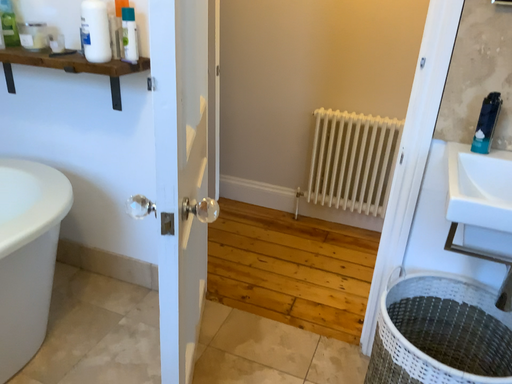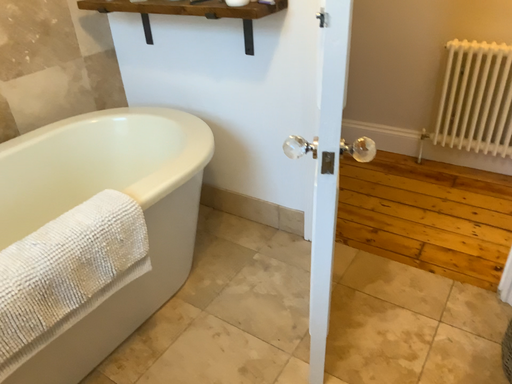
Question: How did the camera likely rotate when shooting the video?

Choices:
 (A) rotated upward
 (B) rotated downward

Answer: (B)